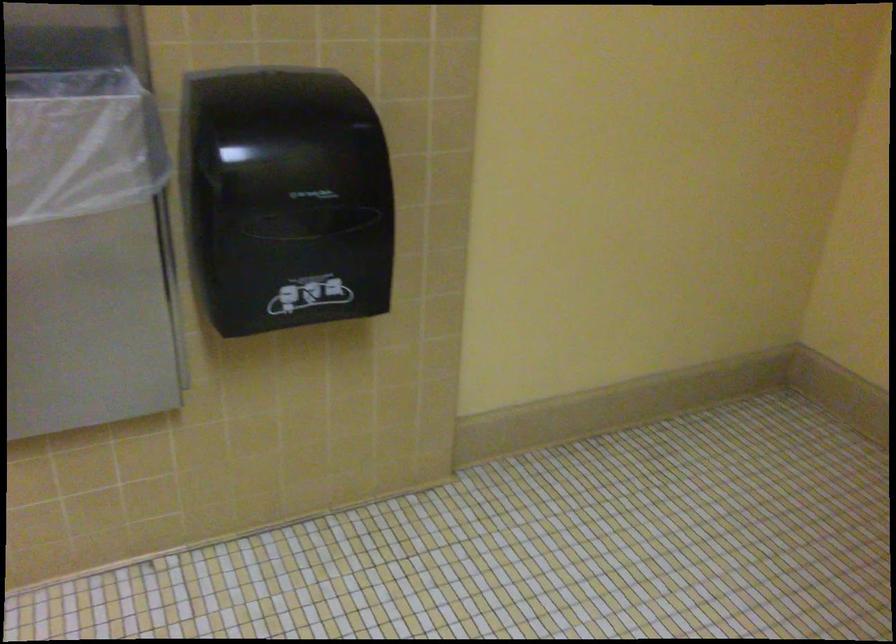
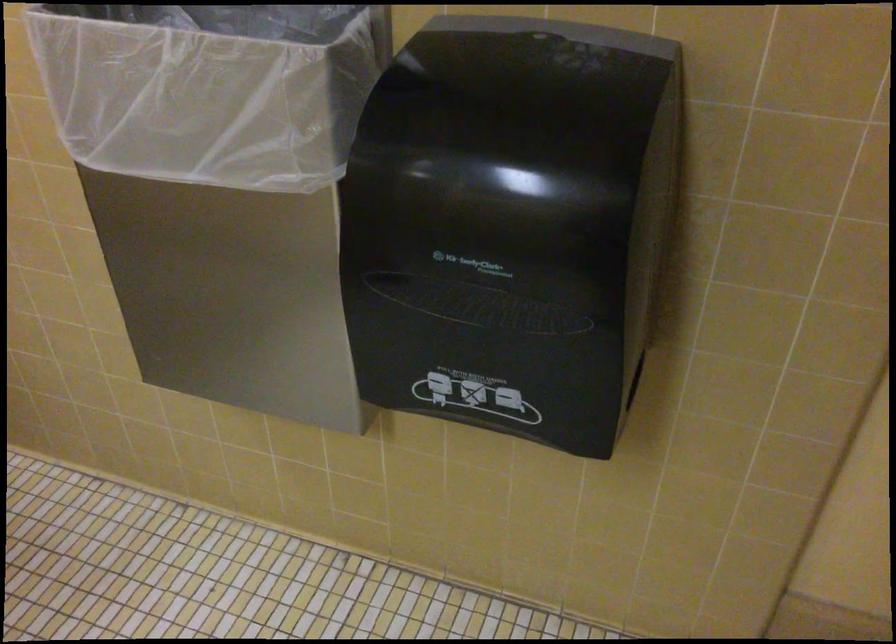
How did the camera likely rotate?

The rotation direction of the camera is left-down.